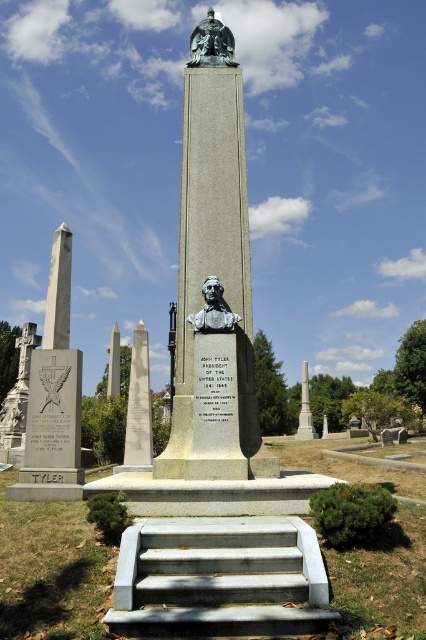
Is bronze statue at center in front of bronze bust at center?

That is True.

In the scene shown: Who is higher up, bronze statue at center or bronze bust at center?

bronze bust at center is above.

This screenshot has width=426, height=640. Describe the element at coordinates (213, 269) in the screenshot. I see `bronze statue at center` at that location.

The height and width of the screenshot is (640, 426). I want to click on bronze statue at center, so click(213, 269).

Can you confirm if bronze statue at upper center is positioned below bronze bust at center?

Actually, bronze statue at upper center is above bronze bust at center.

Is point (218, 44) positioned behind point (224, 314)?

Yes, it is.

This screenshot has height=640, width=426. In order to click on bronze statue at upper center in this screenshot , I will do `click(212, 44)`.

Can you confirm if bronze statue at center is positioned below gray concrete stairs at center?

No, bronze statue at center is not below gray concrete stairs at center.

Between bronze statue at center and gray concrete stairs at center, which one is positioned lower?

Positioned lower is gray concrete stairs at center.

The image size is (426, 640). Find the location of `bronze statue at center`. bronze statue at center is located at coordinates (213, 269).

I want to click on bronze statue at center, so click(213, 269).